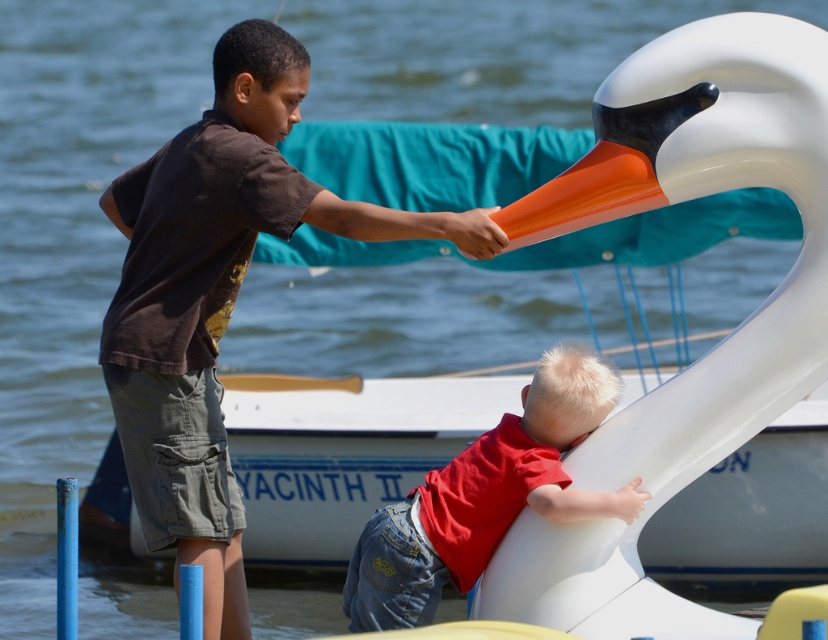
Question: Is brown cotton shirt at upper left closer to the viewer compared to red matte shirt at lower center?

Choices:
 (A) yes
 (B) no

Answer: (A)

Question: Which object is positioned closest to the white glossy swan at upper right?

Choices:
 (A) red matte shirt at lower center
 (B) brown cotton shirt at upper left

Answer: (A)

Question: Which object is positioned closest to the white glossy swan at upper right?

Choices:
 (A) red matte shirt at lower center
 (B) brown cotton shirt at upper left

Answer: (A)

Question: Considering the relative positions of white glossy swan at upper right and brown cotton shirt at upper left in the image provided, where is white glossy swan at upper right located with respect to brown cotton shirt at upper left?

Choices:
 (A) left
 (B) right

Answer: (B)

Question: Can you confirm if white glossy swan at upper right is bigger than red matte shirt at lower center?

Choices:
 (A) no
 (B) yes

Answer: (B)

Question: Which object is the farthest from the brown cotton shirt at upper left?

Choices:
 (A) white glossy swan at upper right
 (B) red matte shirt at lower center

Answer: (A)